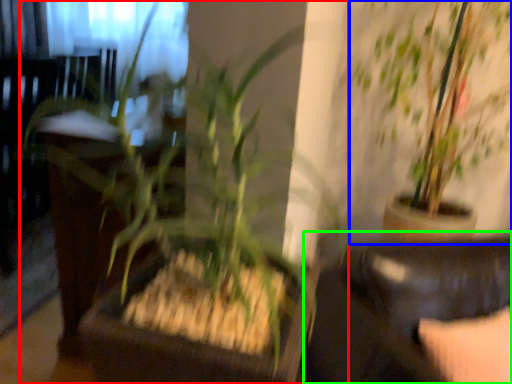
Question: Which object is the farthest from houseplant (highlighted by a red box)? Choose among these: houseplant (highlighted by a blue box) or rocking chair (highlighted by a green box).

Choices:
 (A) houseplant
 (B) rocking chair

Answer: (A)